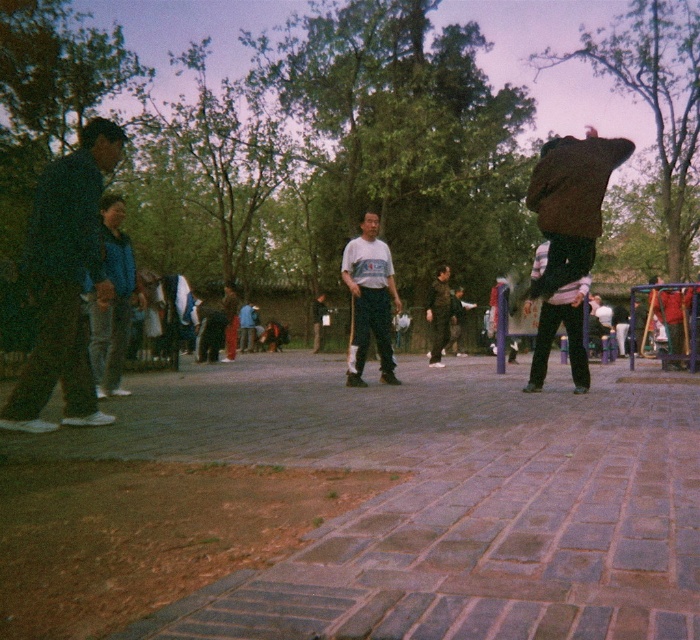
Question: Can you confirm if dark brown leather jacket at right is positioned below white matte shirt at center?

Choices:
 (A) yes
 (B) no

Answer: (B)

Question: Among these objects, which one is nearest to the camera?

Choices:
 (A) white matte shirt at center
 (B) dark blue suit at left
 (C) dark brown leather jacket at right

Answer: (B)

Question: Which object appears closest to the camera in this image?

Choices:
 (A) dark brown leather jacket at right
 (B) dark blue suit at left
 (C) white matte shirt at center

Answer: (B)

Question: Can you confirm if dark brown leather jacket at right is wider than white matte shirt at center?

Choices:
 (A) yes
 (B) no

Answer: (A)

Question: Is dark blue suit at left closer to camera compared to dark brown leather jacket at right?

Choices:
 (A) no
 (B) yes

Answer: (B)

Question: Based on their relative distances, which object is farther from the dark brown leather jacket at right?

Choices:
 (A) dark blue suit at left
 (B) white matte shirt at center

Answer: (A)